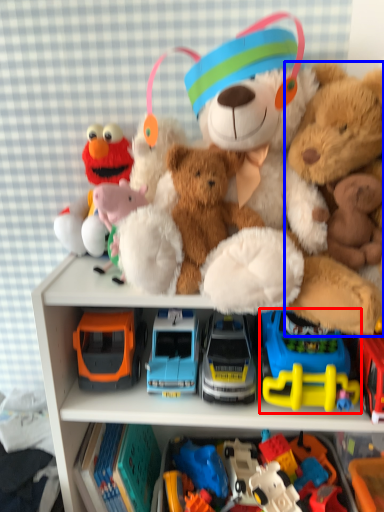
Question: Which of the following is the closest to the observer, toy (highlighted by a red box) or teddy bear (highlighted by a blue box)?

Choices:
 (A) toy
 (B) teddy bear

Answer: (B)